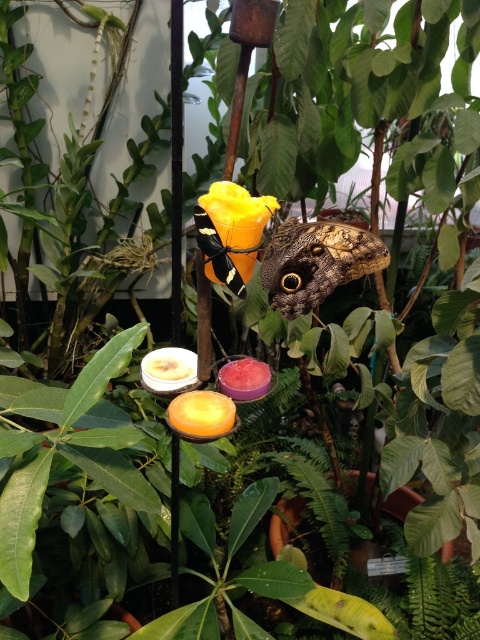
Question: Is camouflage-patterned moth at center smaller than yellow matte flower at center?

Choices:
 (A) no
 (B) yes

Answer: (A)

Question: Does camouflage-patterned moth at center appear over yellow matte flower at center?

Choices:
 (A) yes
 (B) no

Answer: (B)

Question: Does camouflage-patterned moth at center come in front of yellow matte flower at center?

Choices:
 (A) yes
 (B) no

Answer: (B)

Question: Among these points, which one is nearest to the camera?

Choices:
 (A) (224, 218)
 (B) (348, 252)

Answer: (A)